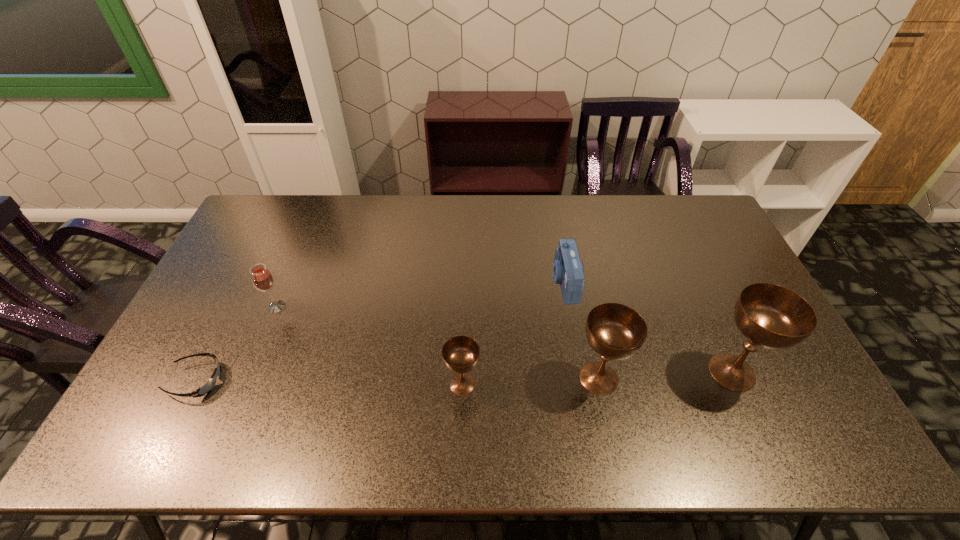
Observe the arrangement of all chalices in the image. To keep them evenly spaced, where would you place another chalice on the left? Please locate a free space. Please provide its 2D coordinates. Your answer should be formatted as a tuple, i.e. [(x, y)], where the tuple contains the x and y coordinates of a point satisfying the conditions above.

[(324, 391)]